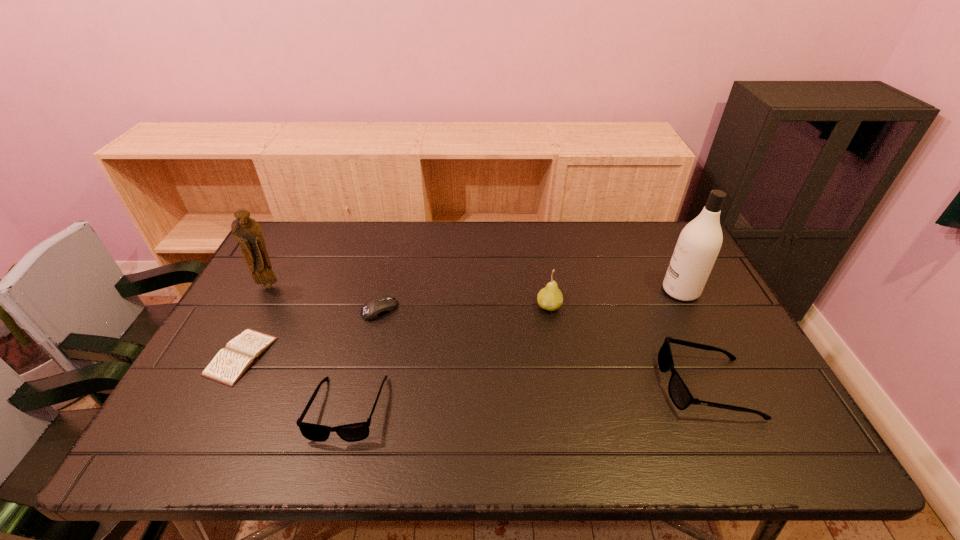
Please point a location where one more sunglasses can be added evenly. Please provide its 2D coordinates. Your answer should be formatted as a tuple, i.e. [(x, y)], where the tuple contains the x and y coordinates of a point satisfying the conditions above.

[(531, 397)]